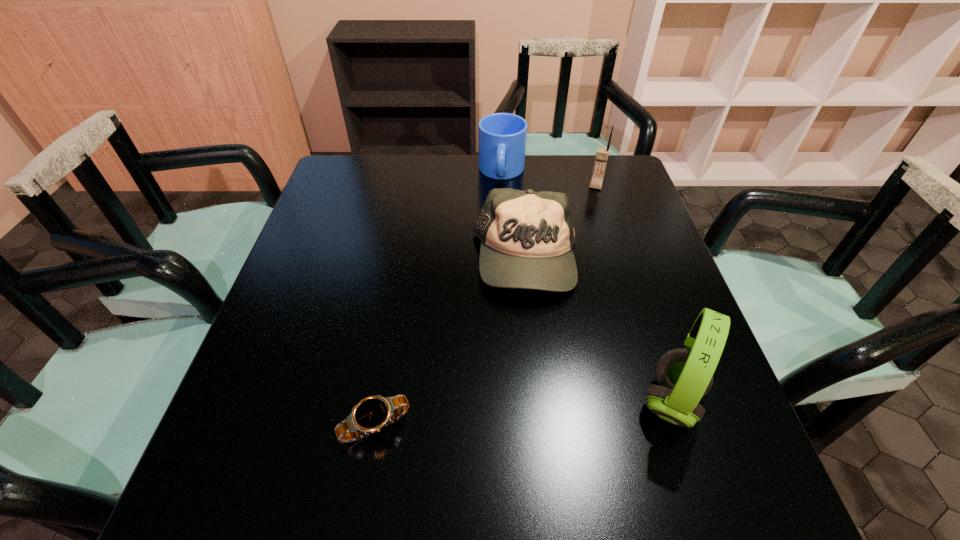
This screenshot has width=960, height=540. I want to click on free region at the far left corner of the desktop, so click(377, 161).

Image resolution: width=960 pixels, height=540 pixels. Find the location of `vacant space at the far right corner`. vacant space at the far right corner is located at coordinates (612, 179).

Where is `free space between the headset and the leftmost object`? free space between the headset and the leftmost object is located at coordinates (523, 413).

Image resolution: width=960 pixels, height=540 pixels. What are the coordinates of `vacant area that lies between the cellular telephone and the headset` in the screenshot? It's located at (634, 293).

This screenshot has width=960, height=540. Find the location of `free space that is in between the cellular telephone and the watch`. free space that is in between the cellular telephone and the watch is located at coordinates (486, 306).

Where is `free space that is in between the third nearest object and the headset`? The image size is (960, 540). free space that is in between the third nearest object and the headset is located at coordinates (599, 330).

Identify the location of vacant area that lies between the leftmost object and the cellular telephone. (486, 306).

Where is `vacant region between the mug and the leftmost object`? The image size is (960, 540). vacant region between the mug and the leftmost object is located at coordinates (439, 299).

I want to click on free spot between the mug and the cellular telephone, so click(x=549, y=179).

Where is `unoccupied position between the shortest object and the mug`? unoccupied position between the shortest object and the mug is located at coordinates (439, 299).